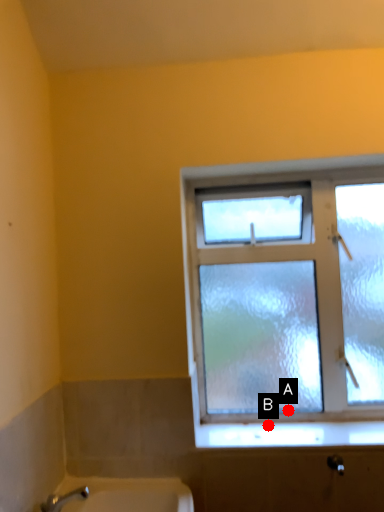
Question: Two points are circled on the image, labeled by A and B beside each circle. Which point is closer to the camera?

Choices:
 (A) A is closer
 (B) B is closer

Answer: (B)